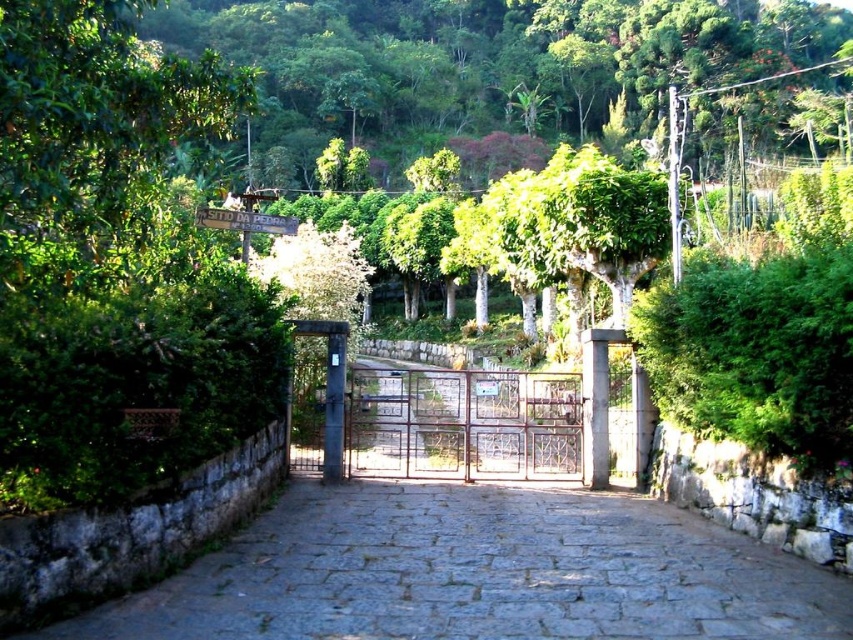
In the scene shown: You are standing at the entrance of the property and see the metallic gate at center and the metal gate at center. Which one is positioned to the right?

The metallic gate at center is positioned to the right of the metal gate at center according to the description.

You are standing at the entrance of the property and want to walk towards the metal gate at center. Which direction should you move relative to the gray stone path at center?

The gray stone path at center is located below the metal gate at center, so you should move upwards along the gray stone path at center to reach the metal gate at center.